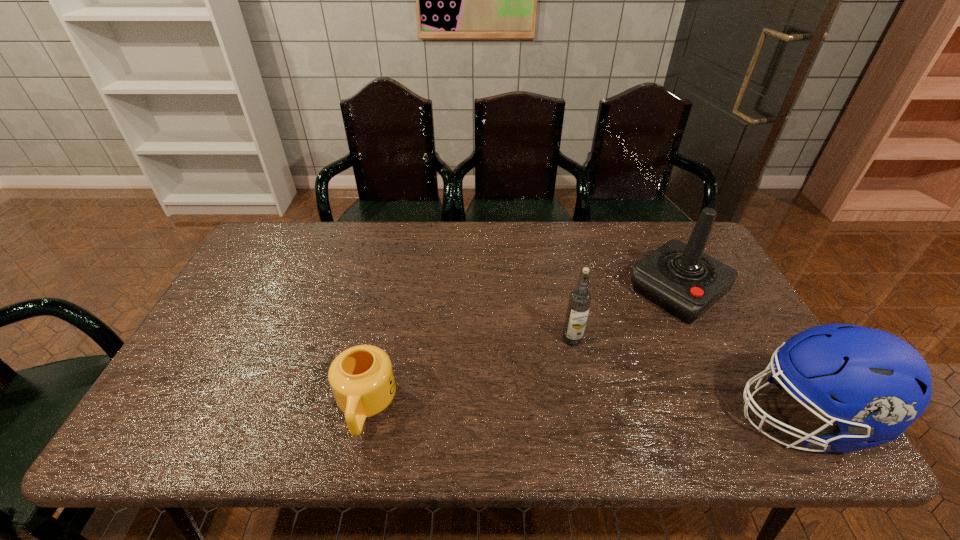
Find the location of a particular element. The width and height of the screenshot is (960, 540). vacant space on the desktop that is between the shortest object and the football helmet and is positioned on the front-facing side of the farthest object is located at coordinates (530, 411).

Identify the location of vacant space on the desktop that is between the leftmost object and the football helmet and is positioned on the label of the third object from right to left. (518, 410).